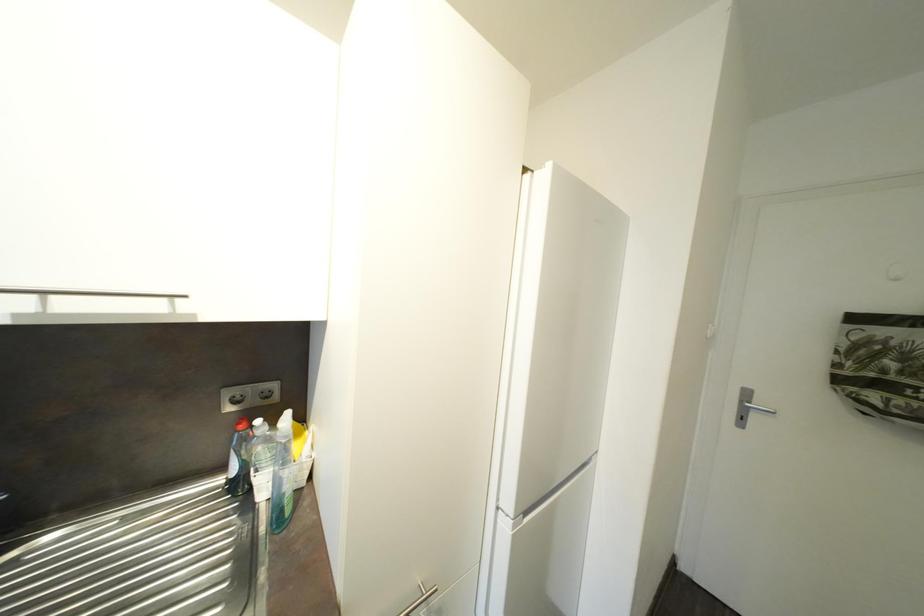
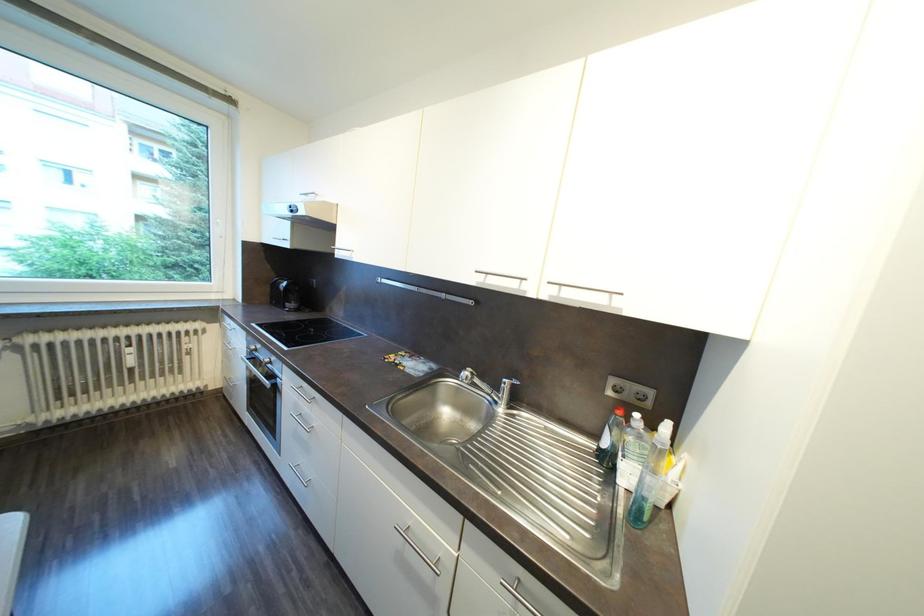
Question: The camera is either moving clockwise (left) or counter-clockwise (right) around the object. The first image is from the beginning of the video and the second image is from the end. Is the camera moving left or right when shooting the video?

Choices:
 (A) Left
 (B) Right

Answer: (B)